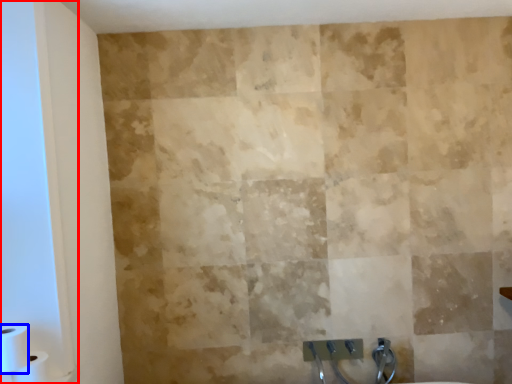
Question: Which point is closer to the camera, glass door (highlighted by a red box) or toilet paper (highlighted by a blue box)?

Choices:
 (A) glass door
 (B) toilet paper

Answer: (A)